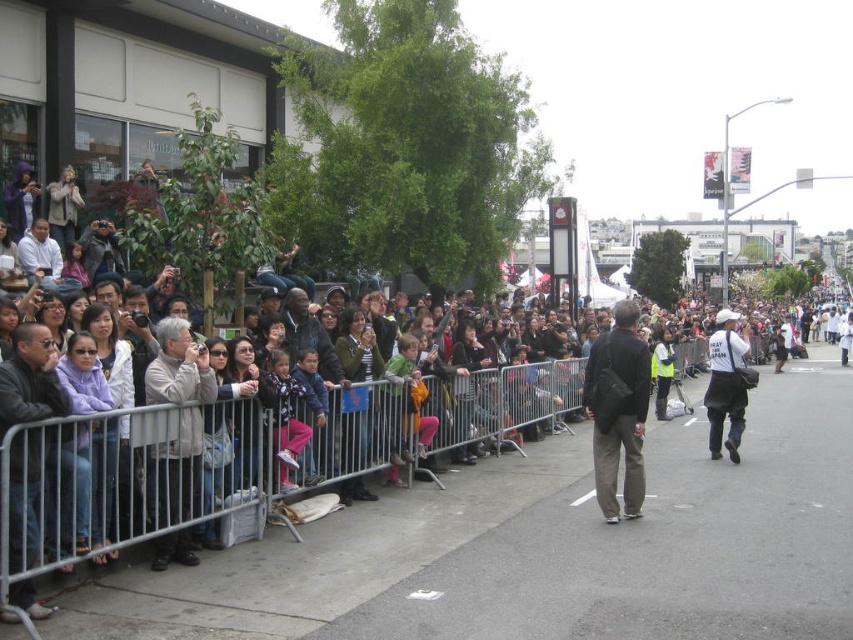
Question: Which is nearer to the dark gray fabric jacket at center?

Choices:
 (A) white matte shirt at left
 (B) matte black jacket at upper left
 (C) white matte vest at center
 (D) gray asphalt pavement at center

Answer: (D)

Question: Is white matte vest at center to the left of white matte shirt at left from the viewer's perspective?

Choices:
 (A) yes
 (B) no

Answer: (B)

Question: Which point is closer to the camera taking this photo?

Choices:
 (A) (36, 224)
 (B) (459, 582)
 (C) (459, 513)
 (D) (622, 442)

Answer: (B)

Question: Does matte black jacket at upper left appear over dark gray jacket at left?

Choices:
 (A) yes
 (B) no

Answer: (B)

Question: Which object is closer to the camera taking this photo?

Choices:
 (A) gray asphalt pavement at center
 (B) white matte shirt at left
 (C) dark gray fabric jacket at center

Answer: (A)

Question: From the image, what is the correct spatial relationship of matte black jacket at upper left in relation to white matte vest at center?

Choices:
 (A) below
 (B) above

Answer: (A)